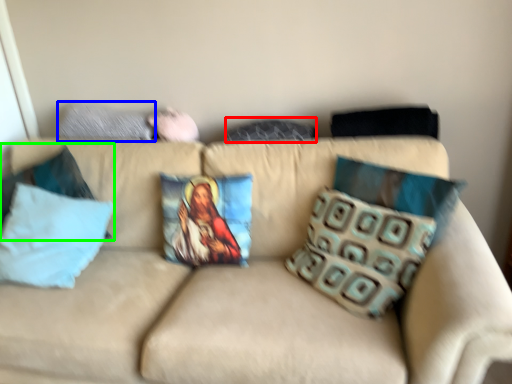
Question: Which is nearer to the pillow (highlighted by a red box)? pillow (highlighted by a blue box) or pillow (highlighted by a green box).

Choices:
 (A) pillow
 (B) pillow

Answer: (A)